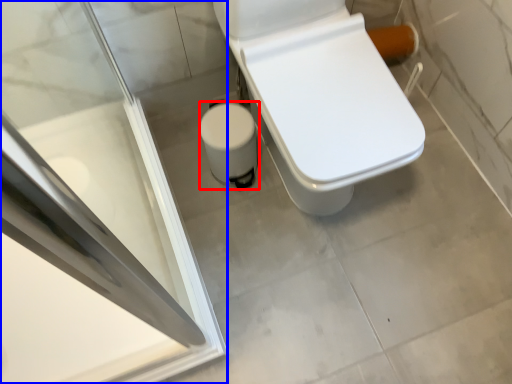
Question: Which object is closer to the camera taking this photo, potty (highlighted by a red box) or screen door (highlighted by a blue box)?

Choices:
 (A) potty
 (B) screen door

Answer: (B)